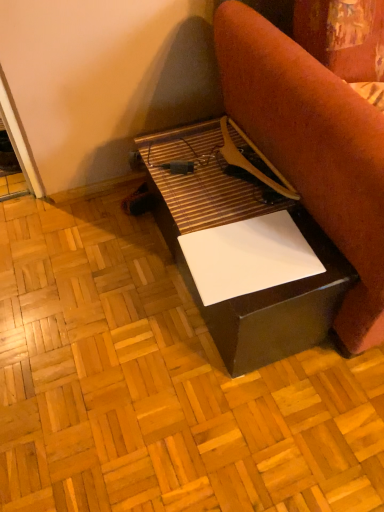
Question: From a real-world perspective, does white glossy paper at center sit lower than matte black table at center?

Choices:
 (A) no
 (B) yes

Answer: (A)

Question: Does white glossy paper at center come behind matte black table at center?

Choices:
 (A) no
 (B) yes

Answer: (A)

Question: Can we say white glossy paper at center lies outside matte black table at center?

Choices:
 (A) no
 (B) yes

Answer: (B)

Question: From the image's perspective, is white glossy paper at center on matte black table at center?

Choices:
 (A) no
 (B) yes

Answer: (B)

Question: Is white glossy paper at center positioned far away from matte black table at center?

Choices:
 (A) yes
 (B) no

Answer: (B)

Question: From a real-world perspective, is white glossy paper at center on top of matte black table at center?

Choices:
 (A) yes
 (B) no

Answer: (A)

Question: Is white glossy plywood at center located outside white glossy paper at center?

Choices:
 (A) no
 (B) yes

Answer: (B)

Question: Is white glossy plywood at center positioned before white glossy paper at center?

Choices:
 (A) yes
 (B) no

Answer: (B)

Question: Is white glossy plywood at center behind white glossy paper at center?

Choices:
 (A) no
 (B) yes

Answer: (B)

Question: Does white glossy plywood at center appear on the right side of white glossy paper at center?

Choices:
 (A) no
 (B) yes

Answer: (A)

Question: Would you say white glossy plywood at center contains white glossy paper at center?

Choices:
 (A) no
 (B) yes

Answer: (A)

Question: Is white glossy plywood at center shorter than white glossy paper at center?

Choices:
 (A) no
 (B) yes

Answer: (B)

Question: Is white glossy plywood at center next to matte black table at center?

Choices:
 (A) no
 (B) yes

Answer: (A)